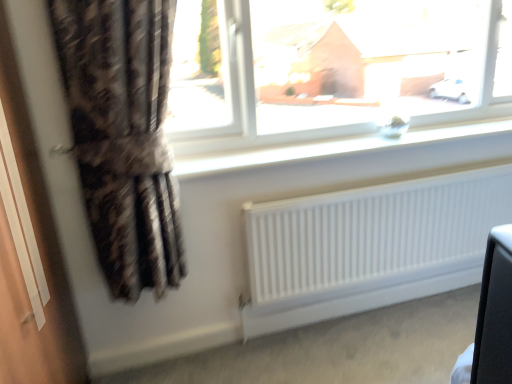
Question: Is white smooth window sill at upper center outside white matte radiator at lower center?

Choices:
 (A) yes
 (B) no

Answer: (A)

Question: Does white smooth window sill at upper center come in front of white matte radiator at lower center?

Choices:
 (A) no
 (B) yes

Answer: (B)

Question: Could you tell me if white smooth window sill at upper center is facing white matte radiator at lower center?

Choices:
 (A) yes
 (B) no

Answer: (B)

Question: From the image's perspective, would you say white smooth window sill at upper center is positioned over white matte radiator at lower center?

Choices:
 (A) no
 (B) yes

Answer: (B)

Question: Does white smooth window sill at upper center have a smaller size compared to white matte radiator at lower center?

Choices:
 (A) no
 (B) yes

Answer: (B)

Question: Does point (298, 54) appear closer or farther from the camera than point (200, 155)?

Choices:
 (A) farther
 (B) closer

Answer: (A)

Question: Considering the positions of transparent glass window at upper center and white smooth window sill at upper center in the image, is transparent glass window at upper center taller or shorter than white smooth window sill at upper center?

Choices:
 (A) tall
 (B) short

Answer: (A)

Question: Visually, is transparent glass window at upper center positioned to the left or to the right of white smooth window sill at upper center?

Choices:
 (A) left
 (B) right

Answer: (A)

Question: From a real-world perspective, is transparent glass window at upper center above or below white smooth window sill at upper center?

Choices:
 (A) above
 (B) below

Answer: (A)

Question: Visually, is white smooth window sill at upper center positioned to the left or to the right of white matte radiator at lower center?

Choices:
 (A) left
 (B) right

Answer: (A)

Question: Which is correct: white smooth window sill at upper center is inside white matte radiator at lower center, or outside of it?

Choices:
 (A) outside
 (B) inside

Answer: (A)

Question: From the image's perspective, relative to white matte radiator at lower center, is white smooth window sill at upper center above or below?

Choices:
 (A) below
 (B) above

Answer: (B)

Question: From a real-world perspective, relative to white matte radiator at lower center, is white smooth window sill at upper center vertically above or below?

Choices:
 (A) above
 (B) below

Answer: (A)

Question: From a real-world perspective, relative to transparent glass window at upper center, is white smooth window sill at upper center vertically above or below?

Choices:
 (A) above
 (B) below

Answer: (B)

Question: Is white smooth window sill at upper center to the left or to the right of transparent glass window at upper center in the image?

Choices:
 (A) right
 (B) left

Answer: (A)